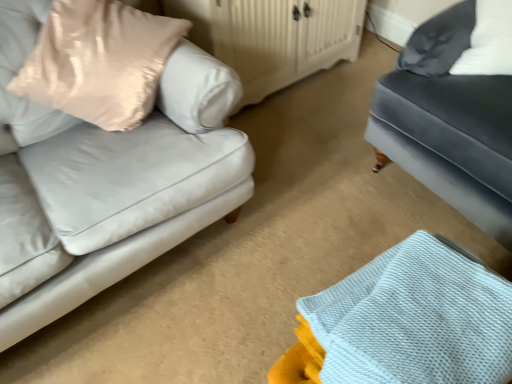
Question: Is white wood dresser at center positioned behind white textured fabric at lower right?

Choices:
 (A) yes
 (B) no

Answer: (A)

Question: From a real-world perspective, is white wood dresser at center beneath white textured fabric at lower right?

Choices:
 (A) no
 (B) yes

Answer: (B)

Question: Can you confirm if white wood dresser at center is positioned to the left of white textured fabric at lower right?

Choices:
 (A) yes
 (B) no

Answer: (A)

Question: Could white textured fabric at lower right be considered to be inside white wood dresser at center?

Choices:
 (A) no
 (B) yes

Answer: (A)

Question: Is white wood dresser at center not near white textured fabric at lower right?

Choices:
 (A) no
 (B) yes

Answer: (B)

Question: From a real-world perspective, is matte gray couch at right above or below white wood dresser at center?

Choices:
 (A) above
 (B) below

Answer: (A)

Question: From the image's perspective, is matte gray couch at right above or below white wood dresser at center?

Choices:
 (A) above
 (B) below

Answer: (B)

Question: In the image, is matte gray couch at right positioned in front of or behind white wood dresser at center?

Choices:
 (A) front
 (B) behind

Answer: (A)

Question: Would you say matte gray couch at right is to the left or to the right of white wood dresser at center in the picture?

Choices:
 (A) left
 (B) right

Answer: (B)

Question: Would you say white wood dresser at center is inside or outside white textured fabric at lower right?

Choices:
 (A) outside
 (B) inside

Answer: (A)

Question: Considering the positions of white wood dresser at center and white textured fabric at lower right in the image, is white wood dresser at center wider or thinner than white textured fabric at lower right?

Choices:
 (A) thin
 (B) wide

Answer: (B)

Question: In terms of height, does white wood dresser at center look taller or shorter compared to white textured fabric at lower right?

Choices:
 (A) short
 (B) tall

Answer: (B)

Question: Relative to white textured fabric at lower right, is white wood dresser at center in front or behind?

Choices:
 (A) behind
 (B) front

Answer: (A)

Question: Considering the relative positions of matte gray couch at right and white textured fabric at lower right in the image provided, is matte gray couch at right to the left or to the right of white textured fabric at lower right?

Choices:
 (A) left
 (B) right

Answer: (B)

Question: Is point (490, 82) positioned closer to the camera than point (325, 311)?

Choices:
 (A) farther
 (B) closer

Answer: (A)